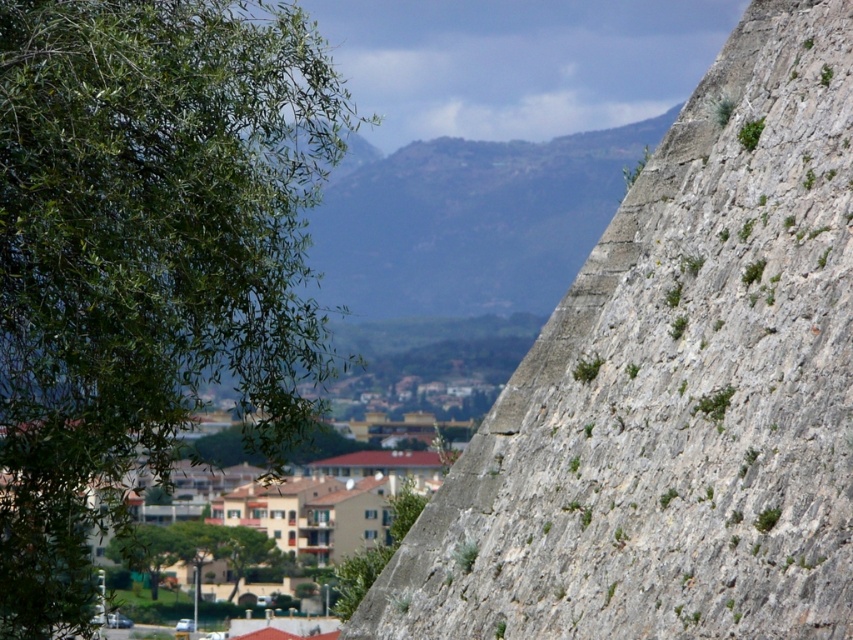
You are standing in front of the large stone wall on the right side of the image. You see two points marked on the wall at coordinates point (830, 392) and point (234, 556). Which point is nearer to you?

Point (830, 392) is closer to the viewer than point (234, 556).

You are standing at the center of the image and want to take a photo of the green leafy tree at left. Which direction should you turn to face the tree?

The green leafy tree at left is located at point coordinates of 0.403 on the x axis and 0.171 on the y axis. Since the tree is at the left side of the image, you should turn to your left to face the tree.

From the picture: You are standing in the scenic view and want to take a photo of the gray rough stone wall at right. According to the coordinates provided, where should you position yourself to capture the wall in your frame?

The gray rough stone wall at right is located at coordinates [675,390], so you should position yourself facing that point to capture it in your frame.